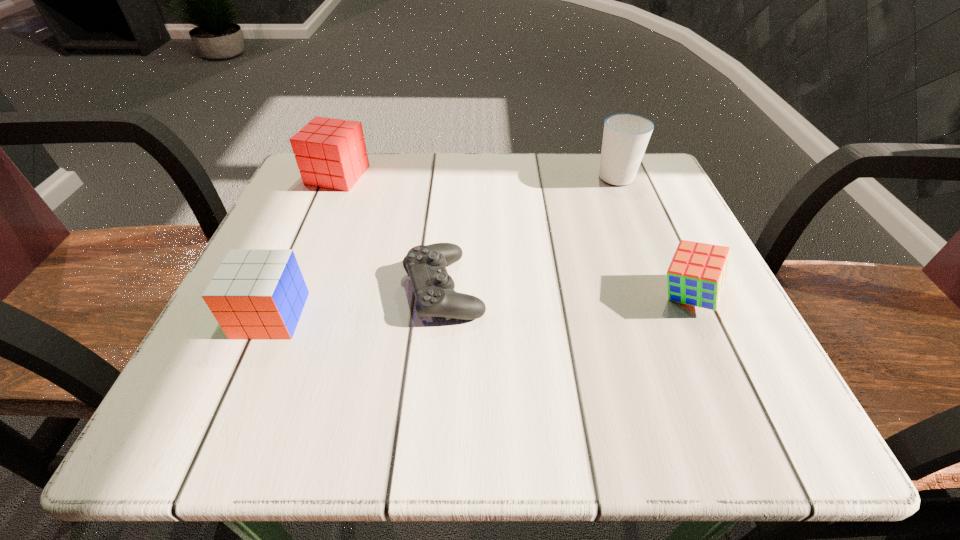
Image resolution: width=960 pixels, height=540 pixels. Identify the location of cup at the right edge. (625, 137).

Locate an element on the screen. This screenshot has width=960, height=540. cube at the right edge is located at coordinates (698, 272).

Where is `object present at the far left corner`? object present at the far left corner is located at coordinates (331, 153).

You are a GUI agent. You are given a task and a screenshot of the screen. Output one action in this format:
    pyautogui.click(x=<x>, y=<y>)
    Task: Click on the object at the far right corner
    
    Given the screenshot: What is the action you would take?
    pyautogui.click(x=625, y=137)

You are a GUI agent. You are given a task and a screenshot of the screen. Output one action in this format:
    pyautogui.click(x=<x>, y=<y>)
    Task: Click on the vacant region at the far edge of the desktop
    Image resolution: width=960 pixels, height=540 pixels.
    Given the screenshot: What is the action you would take?
    (x=492, y=180)

The image size is (960, 540). What are the coordinates of `vacant point at the near edge` in the screenshot? It's located at (636, 432).

Locate an element on the screen. This screenshot has height=540, width=960. free space at the left edge of the desktop is located at coordinates (326, 301).

In the image, there is a desktop. Where is `vacant space at the right edge`? vacant space at the right edge is located at coordinates (683, 218).

Locate an element on the screen. vacant area at the far left corner of the desktop is located at coordinates (360, 191).

Find the location of a particular element. The height and width of the screenshot is (540, 960). free region at the far right corner is located at coordinates (603, 208).